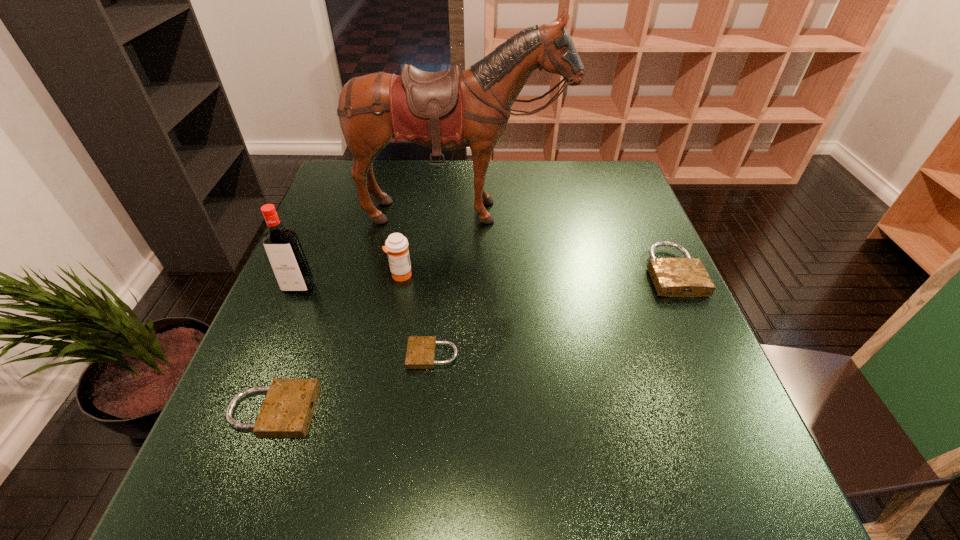
Identify the location of vacant position for inserting another padlock evenly. The image size is (960, 540). (564, 309).